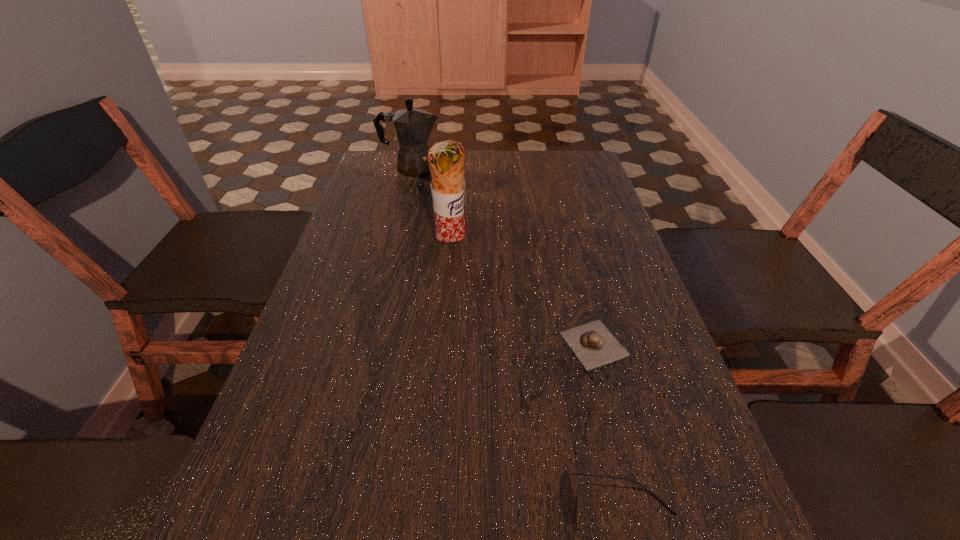
Where is `empty space that is in between the tallest object and the leftmost object`? The height and width of the screenshot is (540, 960). empty space that is in between the tallest object and the leftmost object is located at coordinates [x=431, y=207].

Locate an element on the screen. The height and width of the screenshot is (540, 960). vacant space in between the leftmost object and the burrito is located at coordinates [431, 207].

Where is `vacant space that is in between the tallest object and the second nearest object`? The image size is (960, 540). vacant space that is in between the tallest object and the second nearest object is located at coordinates (522, 295).

Locate which object is the second closest to the sunglasses. Please provide its 2D coordinates. Your answer should be formatted as a tuple, i.e. [(x, y)], where the tuple contains the x and y coordinates of a point satisfying the conditions above.

[(446, 159)]

Locate which object is the second closest to the garlic. Please provide its 2D coordinates. Your answer should be formatted as a tuple, i.e. [(x, y)], where the tuple contains the x and y coordinates of a point satisfying the conditions above.

[(446, 159)]

Identify the location of free space that satisfies the following two spatial constraints: 1. on the pouring side of the leftmost object; 2. on the back side of the tallest object. (392, 246).

Image resolution: width=960 pixels, height=540 pixels. I want to click on free space that satisfies the following two spatial constraints: 1. on the pouring side of the tallest object; 2. on the left side of the leftmost object, so click(392, 246).

Find the location of a particular element. The height and width of the screenshot is (540, 960). vacant space that satisfies the following two spatial constraints: 1. on the pouring side of the tallest object; 2. on the left side of the third shortest object is located at coordinates (392, 246).

Where is `vacant region that satisfies the following two spatial constraints: 1. on the pouring side of the burrito; 2. on the right side of the coffeepot`? Image resolution: width=960 pixels, height=540 pixels. vacant region that satisfies the following two spatial constraints: 1. on the pouring side of the burrito; 2. on the right side of the coffeepot is located at coordinates (392, 246).

Where is `free region that satisfies the following two spatial constraints: 1. on the back side of the garlic; 2. on the pouring side of the farthest object`? The image size is (960, 540). free region that satisfies the following two spatial constraints: 1. on the back side of the garlic; 2. on the pouring side of the farthest object is located at coordinates (549, 168).